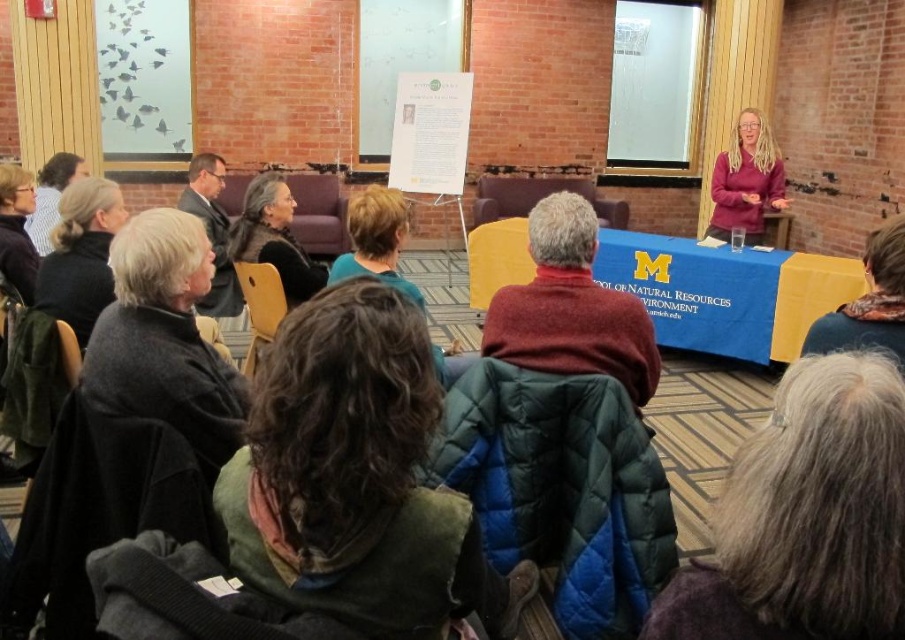
Does point (224, 452) come closer to viewer compared to point (32, 209)?

That is True.

Which is above, dark gray wool coat at left or matte black jacket at left?

matte black jacket at left

Locate an element on the screen. The width and height of the screenshot is (905, 640). dark gray wool coat at left is located at coordinates (164, 339).

Does dark brown curly hair at center appear on the right side of matte black jacket at left?

Yes, dark brown curly hair at center is to the right of matte black jacket at left.

Can you confirm if dark brown curly hair at center is wider than matte black jacket at left?

No.

At what (x,y) coordinates should I click in order to perform the action: click on dark brown curly hair at center. Please return your answer as a coordinate pair (x, y). The width and height of the screenshot is (905, 640). Looking at the image, I should click on (357, 477).

The height and width of the screenshot is (640, 905). What are the coordinates of `gray woolen scarf at lower right` in the screenshot? It's located at (805, 516).

Between point (853, 433) and point (222, 211), which one is positioned behind?

The point (222, 211) is behind.

Locate an element on the screen. gray woolen scarf at lower right is located at coordinates (805, 516).